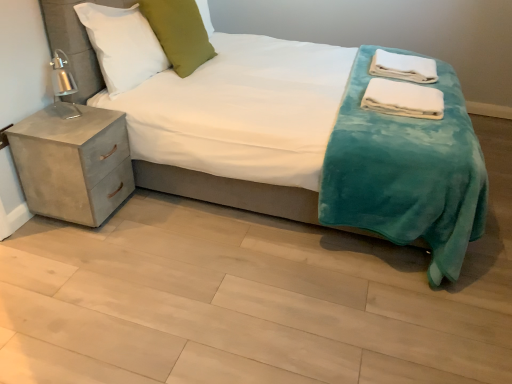
Question: Considering the relative sizes of white soft towels at upper right, the first material in the top-to-bottom sequence, and white soft pillow at upper left, the 2th pillow in the right-to-left sequence, in the image provided, is white soft towels at upper right, the first material in the top-to-bottom sequence, taller than white soft pillow at upper left, the 2th pillow in the right-to-left sequence,?

Choices:
 (A) no
 (B) yes

Answer: (A)

Question: Are white soft towels at upper right, the first material in the top-to-bottom sequence, and white soft pillow at upper left, the 1th pillow positioned from the left, far apart?

Choices:
 (A) yes
 (B) no

Answer: (A)

Question: Does white soft towels at upper right, the first material in the top-to-bottom sequence, have a smaller size compared to white soft pillow at upper left, the 2th pillow in the right-to-left sequence?

Choices:
 (A) yes
 (B) no

Answer: (A)

Question: Would you say white soft pillow at upper left, the 2th pillow in the right-to-left sequence, is part of white soft towels at upper right, the second material from the bottom,'s contents?

Choices:
 (A) yes
 (B) no

Answer: (B)

Question: Does white soft towels at upper right, the first material in the top-to-bottom sequence, have a lesser width compared to white soft pillow at upper left, the 1th pillow positioned from the left?

Choices:
 (A) yes
 (B) no

Answer: (B)

Question: Is white soft towels at upper right, the 1th material positioned from the back, in front of or behind teal plush blanket at center in the image?

Choices:
 (A) behind
 (B) front

Answer: (A)

Question: Looking at the image, does white soft towels at upper right, the first material in the top-to-bottom sequence, seem bigger or smaller compared to teal plush blanket at center?

Choices:
 (A) big
 (B) small

Answer: (B)

Question: Considering the positions of white soft towels at upper right, the 1th material positioned from the back, and teal plush blanket at center in the image, is white soft towels at upper right, the 1th material positioned from the back, wider or thinner than teal plush blanket at center?

Choices:
 (A) thin
 (B) wide

Answer: (A)

Question: From a real-world perspective, is white soft towels at upper right, placed as the 2th material when sorted from front to back, positioned above or below teal plush blanket at center?

Choices:
 (A) above
 (B) below

Answer: (B)

Question: Is white soft towels at right, positioned as the 1th material in front-to-back order, inside the boundaries of teal plush blanket at center, or outside?

Choices:
 (A) outside
 (B) inside

Answer: (B)

Question: Relative to teal plush blanket at center, is white soft towels at right, positioned as the 1th material in front-to-back order, in front or behind?

Choices:
 (A) behind
 (B) front

Answer: (A)

Question: Is point (381, 97) closer or farther from the camera than point (451, 180)?

Choices:
 (A) farther
 (B) closer

Answer: (A)

Question: From a real-world perspective, is white soft towels at right, the 1th material from the bottom, physically located above or below teal plush blanket at center?

Choices:
 (A) below
 (B) above

Answer: (A)

Question: Considering the positions of white soft towels at right, arranged as the second material when viewed from the top, and green velvet pillow at upper center, the first pillow when ordered from right to left, in the image, is white soft towels at right, arranged as the second material when viewed from the top, bigger or smaller than green velvet pillow at upper center, the first pillow when ordered from right to left,?

Choices:
 (A) big
 (B) small

Answer: (B)

Question: Is point (384, 84) positioned closer to the camera than point (160, 6)?

Choices:
 (A) closer
 (B) farther

Answer: (A)